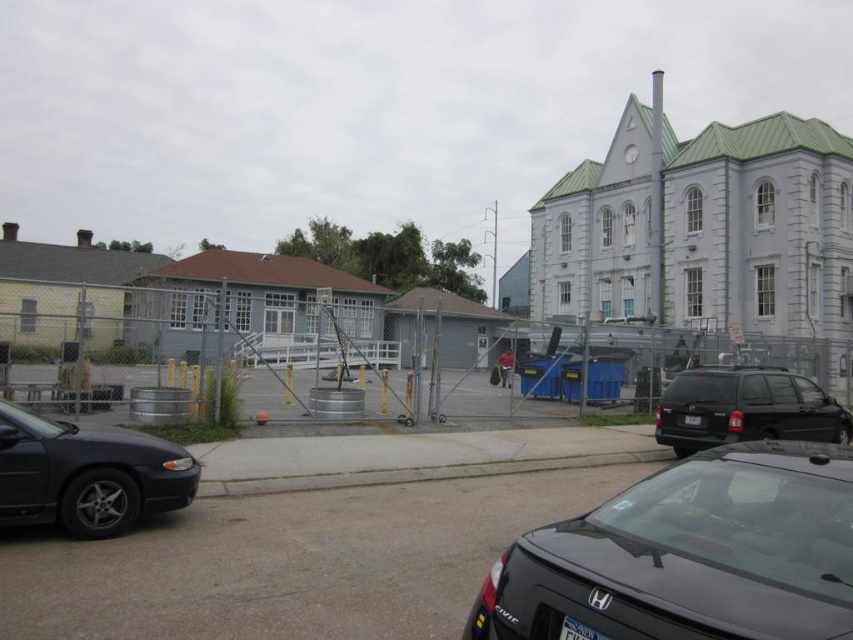
You are standing in the urban scene and want to determine which of the two points, point (123, 467) or point (723, 381), is closer to you. Based on the scene, which point is nearer?

Point (123, 467) is closer to the viewer than point (723, 381).

You are a delivery driver who needs to park your vehicle on the black asphalt parking lot at center. However, you have to pass by the white stone church at upper right to reach the parking spot. Is the parking lot located to the left or right of the church?

The black asphalt parking lot at center is to the left of the white stone church at upper right, so the parking lot is located to the left of the church.